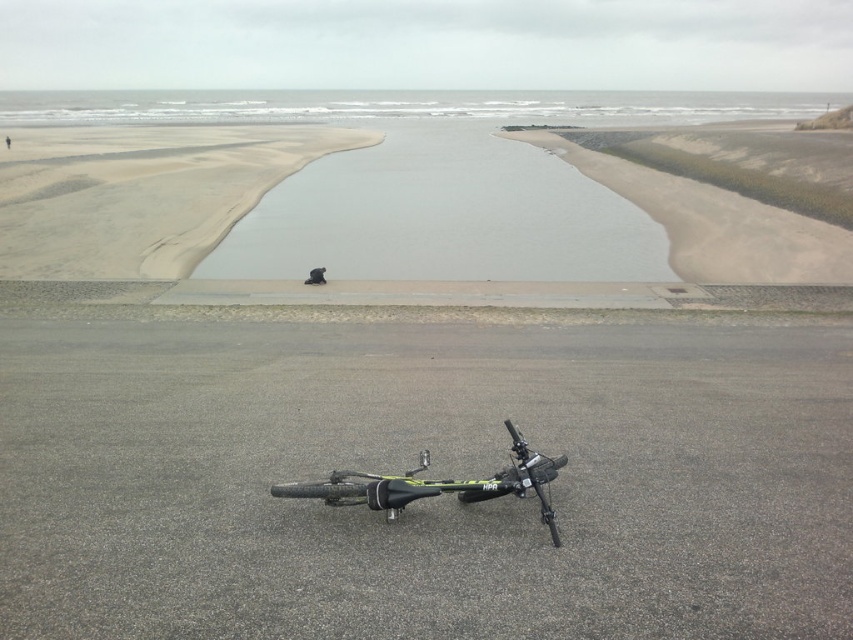
Who is higher up, sandy at lower left or yellow-green matte mountain bike at lower center?

sandy at lower left is higher up.

What do you see at coordinates (140, 193) in the screenshot? This screenshot has height=640, width=853. I see `sandy at lower left` at bounding box center [140, 193].

Who is more distant from viewer, [178,228] or [508,490]?

Positioned behind is point [178,228].

At what (x,y) coordinates should I click in order to perform the action: click on sandy at lower left. Please return your answer as a coordinate pair (x, y). Looking at the image, I should click on (140, 193).

Which is above, sandy at lower left or gray water at upper center?

Positioned higher is gray water at upper center.

Can you confirm if sandy at lower left is shorter than gray water at upper center?

Yes.

Who is more distant from viewer, (263, 172) or (641, 109)?

Point (641, 109)

What are the coordinates of `sandy at lower left` in the screenshot? It's located at (140, 193).

Does point (712, 115) come closer to viewer compared to point (508, 419)?

No.

Who is positioned more to the left, gray water at upper center or yellow-green matte mountain bike at lower center?

gray water at upper center

This screenshot has height=640, width=853. Identify the location of gray water at upper center. (404, 106).

The height and width of the screenshot is (640, 853). I want to click on gray water at upper center, so click(x=404, y=106).